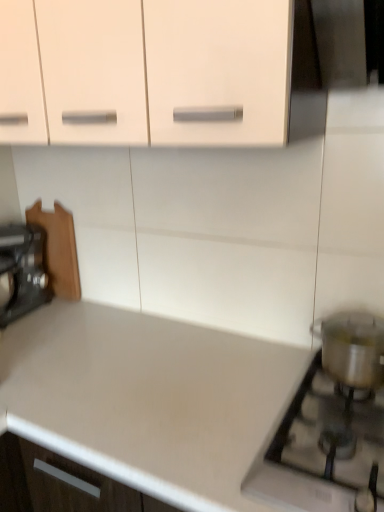
At what (x,y) coordinates should I click in order to perform the action: click on blank space above white matte countertop at lower right (from a real-world perspective). Please return your answer as a coordinate pair (x, y). This screenshot has height=512, width=384. Looking at the image, I should click on (255, 412).